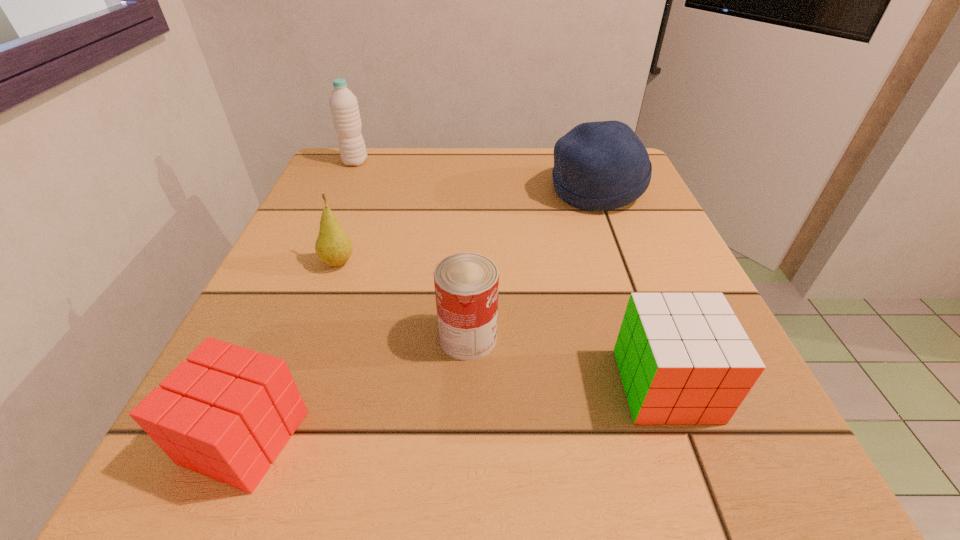
This screenshot has width=960, height=540. I want to click on vacant space located on the back of the pear, so pyautogui.click(x=364, y=194).

Identify the location of free space located 0.090m on the front label of the third object from right to left. (558, 338).

Locate an element on the screen. vacant area situated on the back of the right cube is located at coordinates (608, 227).

Find the location of `vacant space situated on the right of the left cube`. vacant space situated on the right of the left cube is located at coordinates (393, 437).

The height and width of the screenshot is (540, 960). I want to click on water bottle located in the far edge section of the desktop, so click(344, 107).

The image size is (960, 540). What are the coordinates of `skullcap located in the far edge section of the desktop` in the screenshot? It's located at (598, 166).

Find the location of a particular element. water bottle positioned at the left edge is located at coordinates (344, 107).

Locate an element on the screen. pear that is at the left edge is located at coordinates pyautogui.click(x=333, y=246).

The height and width of the screenshot is (540, 960). I want to click on cube located at the left edge, so click(x=226, y=413).

Find the location of a particular element. skullcap present at the right edge is located at coordinates (598, 166).